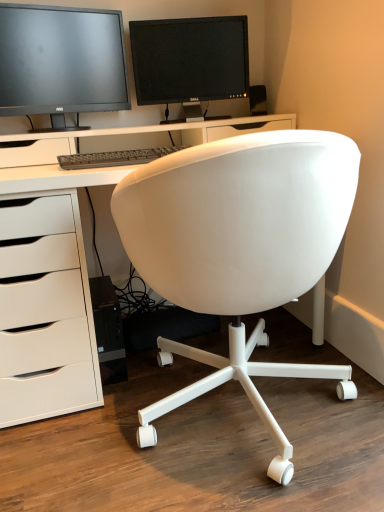
Image resolution: width=384 pixels, height=512 pixels. I want to click on matte black monitor at upper center, the 2th computer monitor positioned from the left, so click(x=190, y=59).

This screenshot has height=512, width=384. What are the coordinates of `white matte office chair at center` in the screenshot? It's located at (239, 249).

The width and height of the screenshot is (384, 512). Find the location of `matte black speaker at upper right`. matte black speaker at upper right is located at coordinates (258, 100).

Looking at this image, how much distance is there between matte black monitor at upper left, the first computer monitor viewed from the left, and gray matte keyboard at center?

matte black monitor at upper left, the first computer monitor viewed from the left, is 14.91 inches away from gray matte keyboard at center.

What's the angular difference between matte black monitor at upper left, arranged as the 2th computer monitor when viewed from the right, and gray matte keyboard at center's facing directions?

matte black monitor at upper left, arranged as the 2th computer monitor when viewed from the right, and gray matte keyboard at center are facing 15.2 degrees away from each other.

Would you say matte black monitor at upper left, arranged as the 2th computer monitor when viewed from the right, is outside gray matte keyboard at center?

That's correct, matte black monitor at upper left, arranged as the 2th computer monitor when viewed from the right, is outside of gray matte keyboard at center.

From the picture: Which is behind, matte black monitor at upper left, the first computer monitor viewed from the left, or gray matte keyboard at center?

matte black monitor at upper left, the first computer monitor viewed from the left, is further away from the camera.

Would you say matte black monitor at upper center, which is the first computer monitor from right to left, is outside white matte office chair at center?

Yes.

Is matte black monitor at upper center, the 2th computer monitor positioned from the left, behind white matte office chair at center?

Yes, matte black monitor at upper center, the 2th computer monitor positioned from the left, is behind white matte office chair at center.

In terms of width, does matte black monitor at upper center, which is the first computer monitor from right to left, look wider or thinner when compared to white matte office chair at center?

matte black monitor at upper center, which is the first computer monitor from right to left, is thinner than white matte office chair at center.

From the image's perspective, would you say matte black monitor at upper center, which is the first computer monitor from right to left, is positioned over white matte office chair at center?

Yes, from the image's perspective, matte black monitor at upper center, which is the first computer monitor from right to left, is on top of white matte office chair at center.

I want to click on computer monitor lying above the matte black monitor at upper left, the first computer monitor viewed from the left (from the image's perspective), so click(190, 59).

From a real-world perspective, is matte black monitor at upper left, arranged as the 2th computer monitor when viewed from the right, physically located above or below matte black monitor at upper center, the 2th computer monitor positioned from the left?

matte black monitor at upper left, arranged as the 2th computer monitor when viewed from the right, is situated higher than matte black monitor at upper center, the 2th computer monitor positioned from the left, in the real world.

Can you tell me how much matte black monitor at upper left, arranged as the 2th computer monitor when viewed from the right, and matte black monitor at upper center, the 2th computer monitor positioned from the left, differ in facing direction?

The angle between the facing direction of matte black monitor at upper left, arranged as the 2th computer monitor when viewed from the right, and the facing direction of matte black monitor at upper center, the 2th computer monitor positioned from the left, is 26.3 degrees.

Which is correct: matte black monitor at upper left, the first computer monitor viewed from the left, is inside matte black monitor at upper center, the 2th computer monitor positioned from the left, or outside of it?

matte black monitor at upper left, the first computer monitor viewed from the left, is located beyond the bounds of matte black monitor at upper center, the 2th computer monitor positioned from the left.

From the picture: Are gray matte keyboard at center and matte black monitor at upper center, which is the first computer monitor from right to left, beside each other?

gray matte keyboard at center and matte black monitor at upper center, which is the first computer monitor from right to left, are not in contact.

Identify the location of computer monitor that is the 2nd object located above the gray matte keyboard at center (from the image's perspective). (190, 59).

From the picture: Between gray matte keyboard at center and matte black monitor at upper center, which is the first computer monitor from right to left, which one has smaller width?

matte black monitor at upper center, which is the first computer monitor from right to left.

Is point (148, 151) more distant than point (224, 59)?

No.

From the image's perspective, is white matte desk at center below matte black speaker at upper right?

Yes.

Which is closer to the camera, (25, 367) or (250, 88)?

Clearly, point (25, 367) is closer to the camera than point (250, 88).

Between white matte desk at center and matte black speaker at upper right, which one has less height?

matte black speaker at upper right.

From the picture: Is matte black speaker at upper right a part of white matte desk at center?

That's incorrect, matte black speaker at upper right is not inside white matte desk at center.

Identify the location of chair in front of the white matte desk at center. (239, 249).

Between white matte office chair at center and white matte desk at center, which one appears on the left side from the viewer's perspective?

white matte desk at center is more to the left.

Measure the distance from white matte office chair at center to white matte desk at center.

white matte office chair at center is 13.11 inches from white matte desk at center.

Is white matte office chair at center far from white matte desk at center?

white matte office chair at center is near white matte desk at center, not far away.

Does matte black speaker at upper right have a larger size compared to gray matte keyboard at center?

No, matte black speaker at upper right is not bigger than gray matte keyboard at center.

What's the angular difference between matte black speaker at upper right and gray matte keyboard at center's facing directions?

They differ by 22 degrees in their facing directions.

Considering the relative sizes of matte black speaker at upper right and gray matte keyboard at center in the image provided, is matte black speaker at upper right shorter than gray matte keyboard at center?

No.

How far apart are matte black speaker at upper right and gray matte keyboard at center?

matte black speaker at upper right and gray matte keyboard at center are 26.43 inches apart.

Where is `computer keyboard on the right of the matte black monitor at upper left, the first computer monitor viewed from the left`? The width and height of the screenshot is (384, 512). computer keyboard on the right of the matte black monitor at upper left, the first computer monitor viewed from the left is located at coordinates (114, 158).

Image resolution: width=384 pixels, height=512 pixels. I want to click on the 1st computer monitor counting from the left of the white matte office chair at center, so click(x=190, y=59).

Based on their spatial positions, is white matte desk at center or matte black speaker at upper right further from gray matte keyboard at center?

The object further to gray matte keyboard at center is matte black speaker at upper right.

Based on their spatial positions, is white matte office chair at center or matte black monitor at upper center, which is the first computer monitor from right to left, closer to matte black monitor at upper left, arranged as the 2th computer monitor when viewed from the right?

Among the two, matte black monitor at upper center, which is the first computer monitor from right to left, is located nearer to matte black monitor at upper left, arranged as the 2th computer monitor when viewed from the right.

From the image, which object appears to be farther from white matte office chair at center, matte black speaker at upper right or gray matte keyboard at center?

The object further to white matte office chair at center is matte black speaker at upper right.

Which object lies further to the anchor point white matte desk at center, gray matte keyboard at center or matte black monitor at upper center, which is the first computer monitor from right to left?

matte black monitor at upper center, which is the first computer monitor from right to left, is further to white matte desk at center.

Considering their positions, is white matte office chair at center positioned closer to matte black monitor at upper left, arranged as the 2th computer monitor when viewed from the right, than white matte desk at center?

white matte desk at center is closer to matte black monitor at upper left, arranged as the 2th computer monitor when viewed from the right.

Based on their spatial positions, is matte black speaker at upper right or matte black monitor at upper left, arranged as the 2th computer monitor when viewed from the right, further from gray matte keyboard at center?

The object further to gray matte keyboard at center is matte black speaker at upper right.

Based on their spatial positions, is matte black monitor at upper left, arranged as the 2th computer monitor when viewed from the right, or white matte office chair at center closer to gray matte keyboard at center?

matte black monitor at upper left, arranged as the 2th computer monitor when viewed from the right, is positioned closer to the anchor gray matte keyboard at center.

Based on the photo, which object lies nearer to the anchor point white matte office chair at center, gray matte keyboard at center or matte black monitor at upper center, which is the first computer monitor from right to left?

gray matte keyboard at center lies closer to white matte office chair at center than the other object.

Where is `desk located between white matte office chair at center and matte black speaker at upper right in the depth direction`? desk located between white matte office chair at center and matte black speaker at upper right in the depth direction is located at coordinates (54, 295).

Locate an element on the screen. computer keyboard between matte black monitor at upper left, the first computer monitor viewed from the left, and white matte office chair at center in the up-down direction is located at coordinates (114, 158).

Locate an element on the screen. This screenshot has width=384, height=512. computer keyboard between matte black monitor at upper center, which is the first computer monitor from right to left, and white matte desk at center in the up-down direction is located at coordinates (114, 158).

Locate an element on the screen. The height and width of the screenshot is (512, 384). computer keyboard located between white matte office chair at center and matte black monitor at upper center, which is the first computer monitor from right to left, in the depth direction is located at coordinates (114, 158).